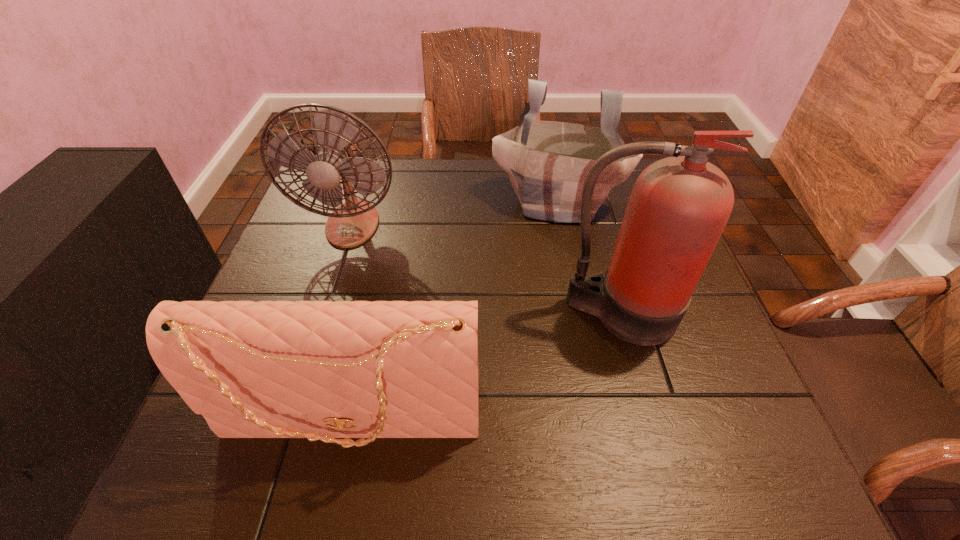
Find the location of a particular element. The height and width of the screenshot is (540, 960). the second nearest object is located at coordinates (679, 206).

The width and height of the screenshot is (960, 540). Identify the location of the tallest object. (679, 206).

Where is `fan`? Image resolution: width=960 pixels, height=540 pixels. fan is located at coordinates (332, 153).

Where is `shopping bag`? Image resolution: width=960 pixels, height=540 pixels. shopping bag is located at coordinates (547, 162).

You are a GUI agent. You are given a task and a screenshot of the screen. Output one action in this format:
    pyautogui.click(x=<x>, y=<y>)
    Task: Click on the handbag
    The width and height of the screenshot is (960, 540).
    Given the screenshot: What is the action you would take?
    pyautogui.click(x=321, y=370)

Find the location of a particular element. The image size is (960, 540). vacant space located 0.200m at the nozzle of the second nearest object is located at coordinates (658, 447).

This screenshot has height=540, width=960. I want to click on free location located 0.360m in front of the fan to direct airflow, so click(300, 386).

Find the location of a particular element. free region located on the front of the shopping bag is located at coordinates (585, 334).

The width and height of the screenshot is (960, 540). Identify the location of fan that is at the far edge. (332, 153).

Identify the location of shopping bag present at the far edge. (547, 162).